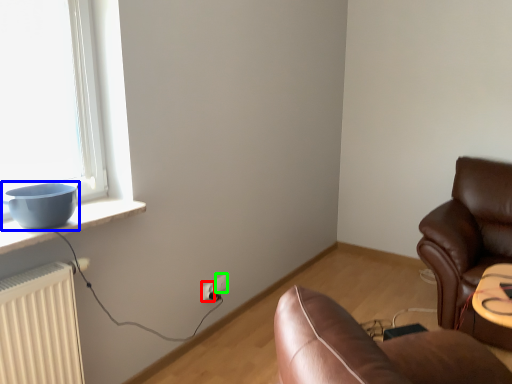
Question: Which object is positioned farthest from electric outlet (highlighted by a red box)? Select from bowl (highlighted by a blue box) and electric outlet (highlighted by a green box).

Choices:
 (A) bowl
 (B) electric outlet

Answer: (A)